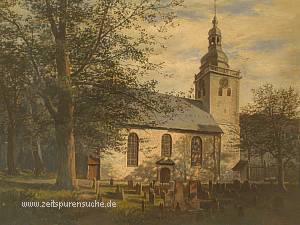
Identify the location of entrance. The image size is (300, 225). (167, 176).